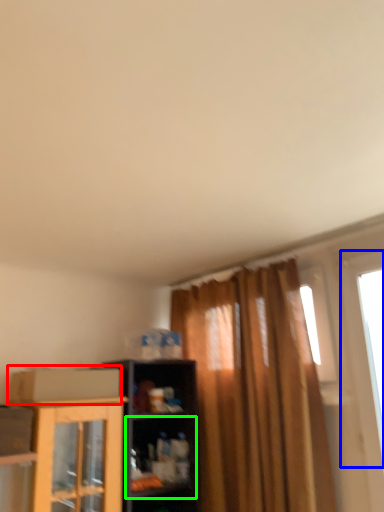
Question: Which object is the closest to the cardboard box (highlighted by a red box)? Choose among these: window (highlighted by a blue box) or shelf (highlighted by a green box).

Choices:
 (A) window
 (B) shelf

Answer: (B)